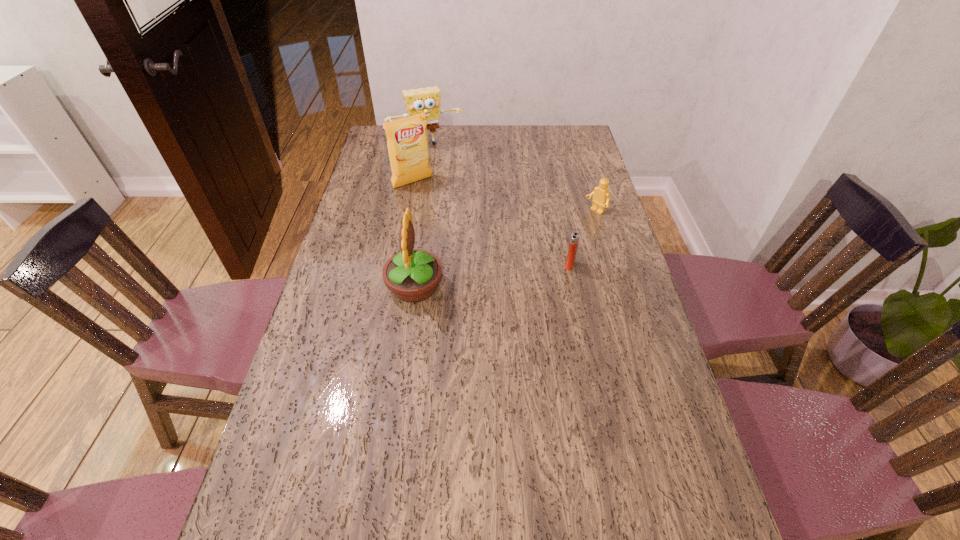
Image resolution: width=960 pixels, height=540 pixels. Find the location of `free point between the fourth nearest object and the third nearest object`. free point between the fourth nearest object and the third nearest object is located at coordinates (504, 197).

You are a GUI agent. You are given a task and a screenshot of the screen. Output one action in this format:
    pyautogui.click(x=<x>, y=<y>)
    Task: Click on the blank region between the igniter and the sunflower
    The width and height of the screenshot is (960, 540).
    Given the screenshot: What is the action you would take?
    pyautogui.click(x=492, y=275)

I want to click on free point between the sponge and the Lego, so click(x=511, y=178).

I want to click on unoccupied position between the farthest object and the sunflower, so click(x=420, y=215).

Locate which object ranks second in proximity to the Lego. Please provide its 2D coordinates. Your answer should be formatted as a tuple, i.e. [(x, y)], where the tuple contains the x and y coordinates of a point satisfying the conditions above.

[(412, 275)]

What are the coordinates of `object that can be found as the third closest to the igniter` in the screenshot? It's located at (407, 141).

The width and height of the screenshot is (960, 540). Identify the location of vacant region that satisfies the following two spatial constraints: 1. on the front side of the sponge; 2. on the right side of the Lego. (416, 212).

Where is `free region that satisfies the following two spatial constraints: 1. on the front side of the second object from right to left; 2. on the right side of the crisp (potato chip)`? free region that satisfies the following two spatial constraints: 1. on the front side of the second object from right to left; 2. on the right side of the crisp (potato chip) is located at coordinates (397, 265).